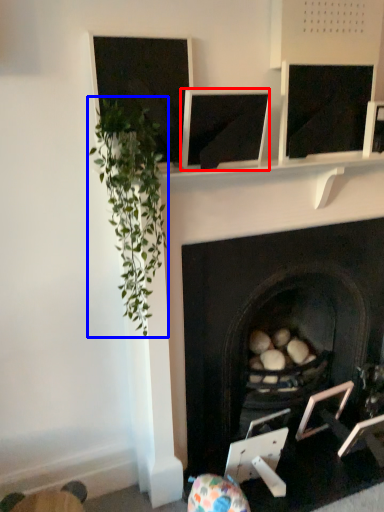
Question: Which object is further to the camera taking this photo, computer screen (highlighted by a red box) or plant (highlighted by a blue box)?

Choices:
 (A) computer screen
 (B) plant

Answer: (A)